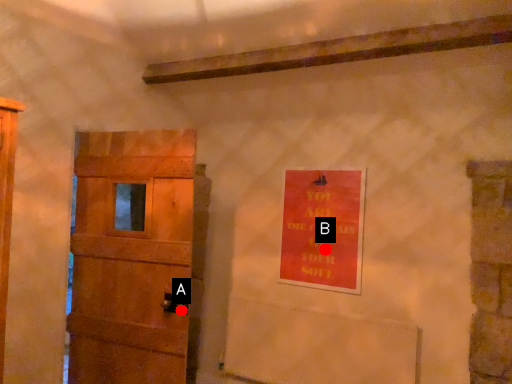
Question: Two points are circled on the image, labeled by A and B beside each circle. Among these points, which one is nearest to the camera?

Choices:
 (A) A is closer
 (B) B is closer

Answer: (A)